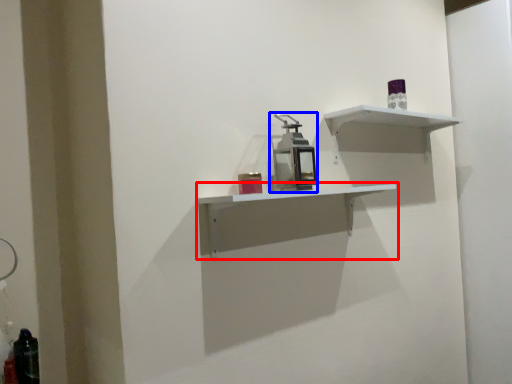
Question: Which point is closer to the camera, shelf (highlighted by a red box) or medicine cabinet (highlighted by a blue box)?

Choices:
 (A) shelf
 (B) medicine cabinet

Answer: (A)